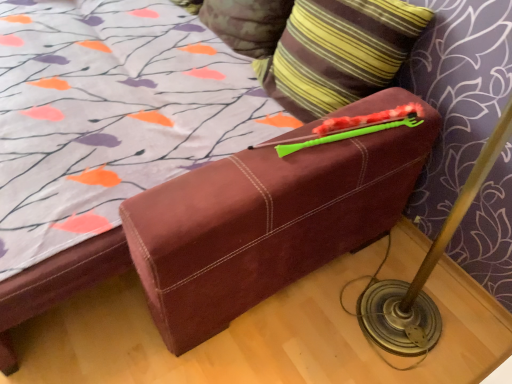
Describe the element at coordinates (339, 53) in the screenshot. The height and width of the screenshot is (384, 512). I see `striped fabric pillow at upper right, marked as the 2th pillow in a back-to-front arrangement` at that location.

This screenshot has height=384, width=512. I want to click on striped fabric pillow at upper right, arranged as the 1th pillow when viewed from the front, so click(339, 53).

What do you see at coordinates (247, 23) in the screenshot? I see `striped fabric pillow at upper center, the second pillow when ordered from front to back` at bounding box center [247, 23].

Find the location of a particular element. striped fabric pillow at upper center, the second pillow when ordered from front to back is located at coordinates (247, 23).

This screenshot has width=512, height=384. I want to click on striped fabric pillow at upper right, marked as the 2th pillow in a back-to-front arrangement, so click(x=339, y=53).

Between striped fabric pillow at upper right, marked as the 2th pillow in a back-to-front arrangement, and striped fabric pillow at upper center, placed as the 1th pillow when sorted from back to front, which one appears on the right side from the viewer's perspective?

From the viewer's perspective, striped fabric pillow at upper right, marked as the 2th pillow in a back-to-front arrangement, appears more on the right side.

In the image, is striped fabric pillow at upper right, marked as the 2th pillow in a back-to-front arrangement, positioned in front of or behind striped fabric pillow at upper center, the second pillow when ordered from front to back?

striped fabric pillow at upper right, marked as the 2th pillow in a back-to-front arrangement, is positioned closer to the viewer than striped fabric pillow at upper center, the second pillow when ordered from front to back.

Is point (343, 37) behind point (258, 35)?

No, it is in front of (258, 35).

From the image's perspective, is striped fabric pillow at upper right, marked as the 2th pillow in a back-to-front arrangement, located above striped fabric pillow at upper center, the second pillow when ordered from front to back?

No, from the image's perspective, striped fabric pillow at upper right, marked as the 2th pillow in a back-to-front arrangement, is not above striped fabric pillow at upper center, the second pillow when ordered from front to back.

From a real-world perspective, who is located higher, striped fabric pillow at upper right, arranged as the 1th pillow when viewed from the front, or striped fabric pillow at upper center, the second pillow when ordered from front to back?

In real-world perspective, striped fabric pillow at upper right, arranged as the 1th pillow when viewed from the front, is above.

Looking at this image, is striped fabric pillow at upper right, arranged as the 1th pillow when viewed from the front, thinner than striped fabric pillow at upper center, placed as the 1th pillow when sorted from back to front?

Incorrect, the width of striped fabric pillow at upper right, arranged as the 1th pillow when viewed from the front, is not less than that of striped fabric pillow at upper center, placed as the 1th pillow when sorted from back to front.

In the scene shown: Who is shorter, striped fabric pillow at upper right, arranged as the 1th pillow when viewed from the front, or striped fabric pillow at upper center, the second pillow when ordered from front to back?

Standing shorter between the two is striped fabric pillow at upper center, the second pillow when ordered from front to back.

Looking at the image, does striped fabric pillow at upper right, marked as the 2th pillow in a back-to-front arrangement, seem bigger or smaller compared to striped fabric pillow at upper center, the second pillow when ordered from front to back?

Considering their sizes, striped fabric pillow at upper right, marked as the 2th pillow in a back-to-front arrangement, takes up more space than striped fabric pillow at upper center, the second pillow when ordered from front to back.

Is striped fabric pillow at upper center, the second pillow when ordered from front to back, located within striped fabric pillow at upper right, marked as the 2th pillow in a back-to-front arrangement?

No, striped fabric pillow at upper right, marked as the 2th pillow in a back-to-front arrangement, does not contain striped fabric pillow at upper center, the second pillow when ordered from front to back.

Are striped fabric pillow at upper right, marked as the 2th pillow in a back-to-front arrangement, and striped fabric pillow at upper center, placed as the 1th pillow when sorted from back to front, located far from each other?

No, there isn't a large distance between striped fabric pillow at upper right, marked as the 2th pillow in a back-to-front arrangement, and striped fabric pillow at upper center, placed as the 1th pillow when sorted from back to front.

Is striped fabric pillow at upper center, placed as the 1th pillow when sorted from back to front, at the back of striped fabric pillow at upper right, marked as the 2th pillow in a back-to-front arrangement?

No, striped fabric pillow at upper right, marked as the 2th pillow in a back-to-front arrangement, is not facing the opposite direction of striped fabric pillow at upper center, placed as the 1th pillow when sorted from back to front.

How many degrees apart are the facing directions of striped fabric pillow at upper right, arranged as the 1th pillow when viewed from the front, and striped fabric pillow at upper center, the second pillow when ordered from front to back?

The angle between the facing direction of striped fabric pillow at upper right, arranged as the 1th pillow when viewed from the front, and the facing direction of striped fabric pillow at upper center, the second pillow when ordered from front to back, is 0.000318 degrees.

Could you measure the distance between striped fabric pillow at upper right, arranged as the 1th pillow when viewed from the front, and striped fabric pillow at upper center, placed as the 1th pillow when sorted from back to front?

striped fabric pillow at upper right, arranged as the 1th pillow when viewed from the front, is 12.40 inches from striped fabric pillow at upper center, placed as the 1th pillow when sorted from back to front.

There is a striped fabric pillow at upper center, placed as the 1th pillow when sorted from back to front. Identify the location of pillow above it (from a real-world perspective). (339, 53).

Between striped fabric pillow at upper center, the second pillow when ordered from front to back, and striped fabric pillow at upper right, arranged as the 1th pillow when viewed from the front, which one appears on the right side from the viewer's perspective?

From the viewer's perspective, striped fabric pillow at upper right, arranged as the 1th pillow when viewed from the front, appears more on the right side.

Considering the relative positions of striped fabric pillow at upper center, the second pillow when ordered from front to back, and striped fabric pillow at upper right, marked as the 2th pillow in a back-to-front arrangement, in the image provided, is striped fabric pillow at upper center, the second pillow when ordered from front to back, behind striped fabric pillow at upper right, marked as the 2th pillow in a back-to-front arrangement,?

Yes, striped fabric pillow at upper center, the second pillow when ordered from front to back, is behind striped fabric pillow at upper right, marked as the 2th pillow in a back-to-front arrangement.

From the picture: Which is farther from the camera, (x=221, y=31) or (x=304, y=96)?

The point (x=221, y=31) is behind.

From the image's perspective, is striped fabric pillow at upper center, placed as the 1th pillow when sorted from back to front, located above or below striped fabric pillow at upper right, arranged as the 1th pillow when viewed from the front?

Based on their image positions, striped fabric pillow at upper center, placed as the 1th pillow when sorted from back to front, is located above striped fabric pillow at upper right, arranged as the 1th pillow when viewed from the front.

From a real-world perspective, is striped fabric pillow at upper center, the second pillow when ordered from front to back, physically above striped fabric pillow at upper right, marked as the 2th pillow in a back-to-front arrangement?

Incorrect, from a real-world perspective, striped fabric pillow at upper center, the second pillow when ordered from front to back, is lower than striped fabric pillow at upper right, marked as the 2th pillow in a back-to-front arrangement.

Which of these two, striped fabric pillow at upper center, the second pillow when ordered from front to back, or striped fabric pillow at upper right, marked as the 2th pillow in a back-to-front arrangement, is wider?

With larger width is striped fabric pillow at upper right, marked as the 2th pillow in a back-to-front arrangement.

Can you confirm if striped fabric pillow at upper center, placed as the 1th pillow when sorted from back to front, is taller than striped fabric pillow at upper right, marked as the 2th pillow in a back-to-front arrangement?

No, striped fabric pillow at upper center, placed as the 1th pillow when sorted from back to front, is not taller than striped fabric pillow at upper right, marked as the 2th pillow in a back-to-front arrangement.

Considering the sizes of striped fabric pillow at upper center, placed as the 1th pillow when sorted from back to front, and striped fabric pillow at upper right, arranged as the 1th pillow when viewed from the front, in the image, is striped fabric pillow at upper center, placed as the 1th pillow when sorted from back to front, bigger or smaller than striped fabric pillow at upper right, arranged as the 1th pillow when viewed from the front,?

In the image, striped fabric pillow at upper center, placed as the 1th pillow when sorted from back to front, appears to be smaller than striped fabric pillow at upper right, arranged as the 1th pillow when viewed from the front.

Is striped fabric pillow at upper right, arranged as the 1th pillow when viewed from the front, a part of striped fabric pillow at upper center, placed as the 1th pillow when sorted from back to front?

Actually, striped fabric pillow at upper right, arranged as the 1th pillow when viewed from the front, is outside striped fabric pillow at upper center, placed as the 1th pillow when sorted from back to front.

Does striped fabric pillow at upper center, placed as the 1th pillow when sorted from back to front, touch striped fabric pillow at upper right, marked as the 2th pillow in a back-to-front arrangement?

No, striped fabric pillow at upper center, placed as the 1th pillow when sorted from back to front, is not making contact with striped fabric pillow at upper right, marked as the 2th pillow in a back-to-front arrangement.

Could you tell me if striped fabric pillow at upper center, placed as the 1th pillow when sorted from back to front, is turned towards striped fabric pillow at upper right, marked as the 2th pillow in a back-to-front arrangement?

No, striped fabric pillow at upper center, placed as the 1th pillow when sorted from back to front, is not oriented towards striped fabric pillow at upper right, marked as the 2th pillow in a back-to-front arrangement.

Can you tell me how much striped fabric pillow at upper center, the second pillow when ordered from front to back, and striped fabric pillow at upper right, arranged as the 1th pillow when viewed from the front, differ in facing direction?

The facing directions of striped fabric pillow at upper center, the second pillow when ordered from front to back, and striped fabric pillow at upper right, arranged as the 1th pillow when viewed from the front, are 0.000318 degrees apart.

In the image, there is a striped fabric pillow at upper right, arranged as the 1th pillow when viewed from the front. Where is `pillow below it (from a real-world perspective)`? The height and width of the screenshot is (384, 512). pillow below it (from a real-world perspective) is located at coordinates (247, 23).

Image resolution: width=512 pixels, height=384 pixels. Find the location of `pillow located above the striped fabric pillow at upper center, the second pillow when ordered from front to back (from a real-world perspective)`. pillow located above the striped fabric pillow at upper center, the second pillow when ordered from front to back (from a real-world perspective) is located at coordinates (339, 53).

In the image, there is a striped fabric pillow at upper center, the second pillow when ordered from front to back. Identify the location of pillow below it (from the image's perspective). (339, 53).